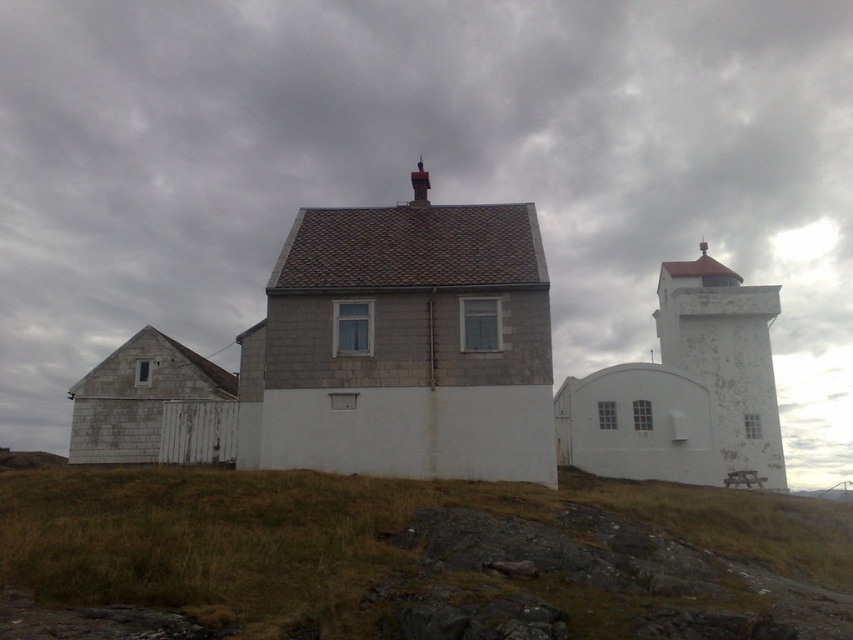
Is green grass at center wider than white painted concrete tower at right?

Yes, green grass at center is wider than white painted concrete tower at right.

The height and width of the screenshot is (640, 853). Find the location of `green grass at center`. green grass at center is located at coordinates (416, 557).

The image size is (853, 640). What are the coordinates of `green grass at center` in the screenshot? It's located at (416, 557).

From the picture: Which is more to the right, white stone house at center or white painted concrete tower at right?

Positioned to the right is white painted concrete tower at right.

Between white stone house at center and white painted concrete tower at right, which one has less height?

With less height is white stone house at center.

Describe the element at coordinates (403, 346) in the screenshot. The height and width of the screenshot is (640, 853). I see `white stone house at center` at that location.

This screenshot has width=853, height=640. I want to click on white stone house at center, so point(403,346).

Based on the photo, measure the distance from green grass at center to white stone house at center.

green grass at center is 6.33 meters from white stone house at center.

Is point (630, 621) positioned after point (456, 403)?

No, it is in front of (456, 403).

I want to click on green grass at center, so click(416, 557).

Where is `green grass at center`? green grass at center is located at coordinates click(416, 557).